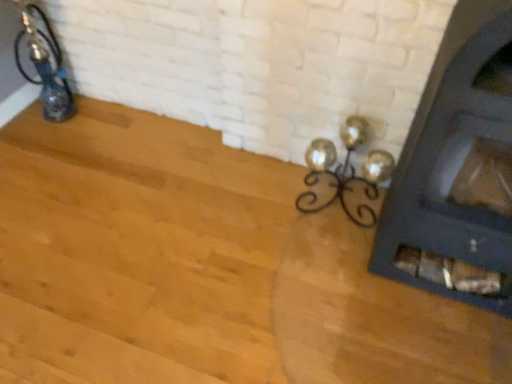
What do you see at coordinates (345, 174) in the screenshot? This screenshot has height=384, width=512. I see `metallic gold lamp at center` at bounding box center [345, 174].

You are a GUI agent. You are given a task and a screenshot of the screen. Output one action in this format:
    pyautogui.click(x=<x>, y=<y>)
    Task: Click on the metallic gold lamp at center
    This screenshot has width=512, height=384.
    Given the screenshot: What is the action you would take?
    pyautogui.click(x=345, y=174)

In order to click on metallic gold lamp at center in this screenshot , I will do `click(345, 174)`.